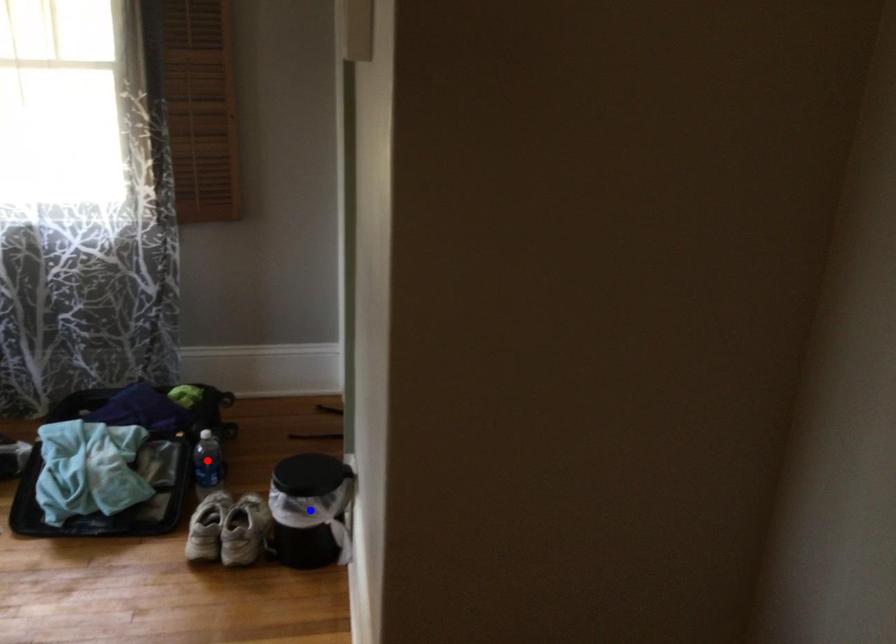
Question: In the image, two points are highlighted. Which point is nearer to the camera? Reply with the corresponding letter.

Choices:
 (A) blue point
 (B) red point

Answer: (A)